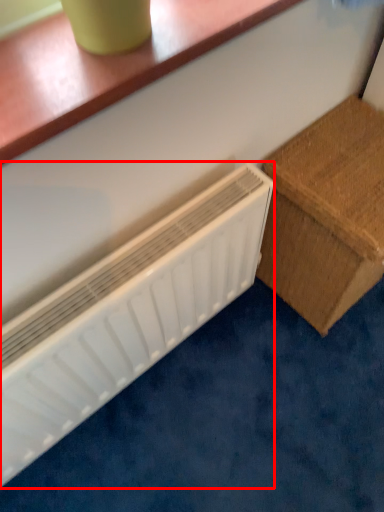
Question: From the image's perspective, what is the correct spatial positioning of radiator (annotated by the red box) in reference to furniture?

Choices:
 (A) below
 (B) above

Answer: (A)